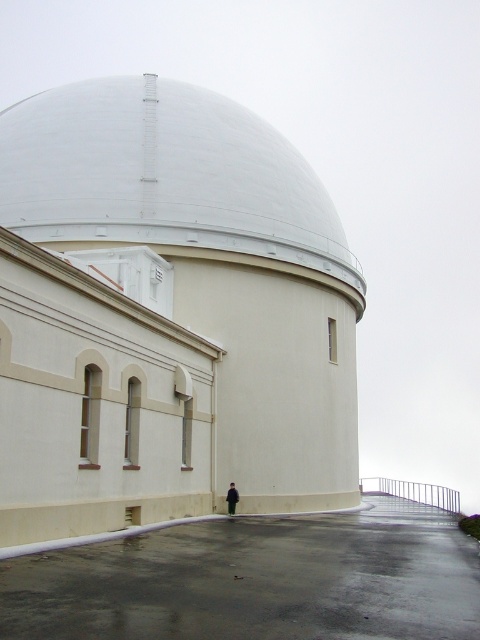
You are standing at the entrance of the observatory and want to reach the point marked at coordinates point (197, 250). If your walking speed is 1.5 meters per second, how many seconds will it take you to reach that point?

The distance between you and the point (197, 250) is 28.15 meters. At a speed of 1.5 meters per second, it will take approximately 19 seconds to reach the point.

You are an architect designing a new observatory. You have a model of the white smooth dome at center and a miniature of the black matte jacket at lower center. If you want to maintain the scale between the two, which object should be larger in your model?

The white smooth dome at center should be larger in the model since it is bigger than the black matte jacket at lower center in the actual scene.

You are standing at the base of the white smooth dome at center in the observatory. You notice a specific point marked at coordinates (167, 177). Where exactly is this point located on the dome?

The point at coordinates (167, 177) is on the white smooth dome at center.